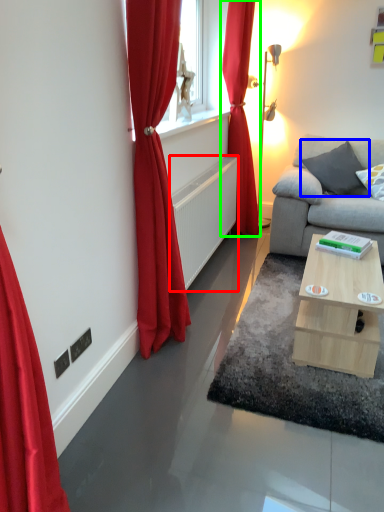
Question: Which object is positioned closest to radiator (highlighted by a red box)? Select from pillow (highlighted by a blue box) and curtain (highlighted by a green box).

Choices:
 (A) pillow
 (B) curtain

Answer: (B)